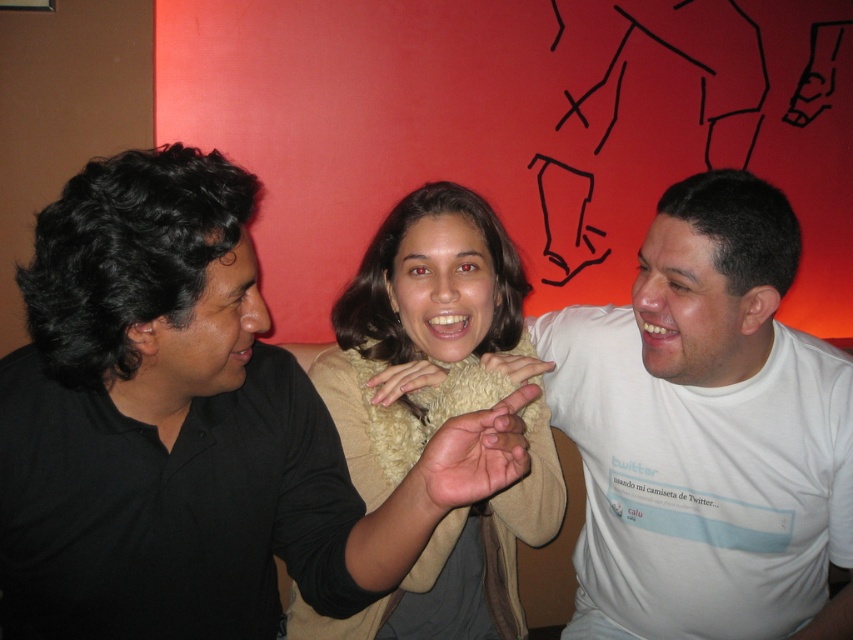
Question: Considering the relative positions of black matte shirt at left and beige fuzzy scarf at center in the image provided, where is black matte shirt at left located with respect to beige fuzzy scarf at center?

Choices:
 (A) right
 (B) left

Answer: (B)

Question: Among these objects, which one is nearest to the camera?

Choices:
 (A) white cotton shirt at center
 (B) black matte shirt at left
 (C) beige fuzzy scarf at center

Answer: (B)

Question: Is the position of black matte shirt at left more distant than that of white cotton shirt at center?

Choices:
 (A) yes
 (B) no

Answer: (B)

Question: Estimate the real-world distances between objects in this image. Which object is closer to the black matte shirt at left?

Choices:
 (A) beige fuzzy scarf at center
 (B) white cotton shirt at center

Answer: (A)

Question: Can you confirm if black matte shirt at left is positioned to the right of white cotton shirt at center?

Choices:
 (A) no
 (B) yes

Answer: (A)

Question: Which point appears farthest from the camera in this image?

Choices:
 (A) (351, 307)
 (B) (581, 378)

Answer: (B)